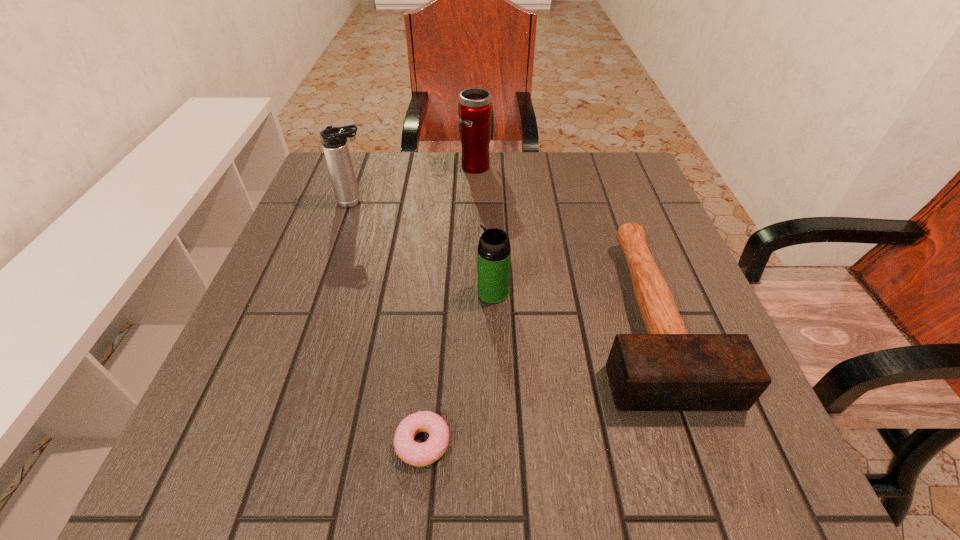
In the image, there is a desktop. What are the coordinates of `vacant space at the near edge` in the screenshot? It's located at (334, 482).

What are the coordinates of `free point at the left edge` in the screenshot? It's located at (323, 322).

In the image, there is a desktop. Where is `vacant space at the far left corner`? The height and width of the screenshot is (540, 960). vacant space at the far left corner is located at coordinates (324, 176).

At what (x,y) coordinates should I click in order to perform the action: click on blank space at the near left corner of the desktop. Please return your answer as a coordinate pair (x, y). Image resolution: width=960 pixels, height=540 pixels. Looking at the image, I should click on (211, 486).

Where is `free space at the far right corner of the desktop`? The height and width of the screenshot is (540, 960). free space at the far right corner of the desktop is located at coordinates (601, 158).

Locate an element on the screen. free space at the near right corner of the desktop is located at coordinates (722, 460).

This screenshot has height=540, width=960. Find the location of `empty space that is in between the shortest object and the nearest thermos bottle`. empty space that is in between the shortest object and the nearest thermos bottle is located at coordinates (458, 368).

This screenshot has width=960, height=540. I want to click on vacant area that lies between the second farthest object and the farthest object, so click(x=416, y=184).

Identify the location of vacant space that's between the nearest object and the farthest thermos bottle. The image size is (960, 540). (450, 304).

Where is `free space between the second nearest thermos bottle and the third shortest object`? This screenshot has width=960, height=540. free space between the second nearest thermos bottle and the third shortest object is located at coordinates (423, 247).